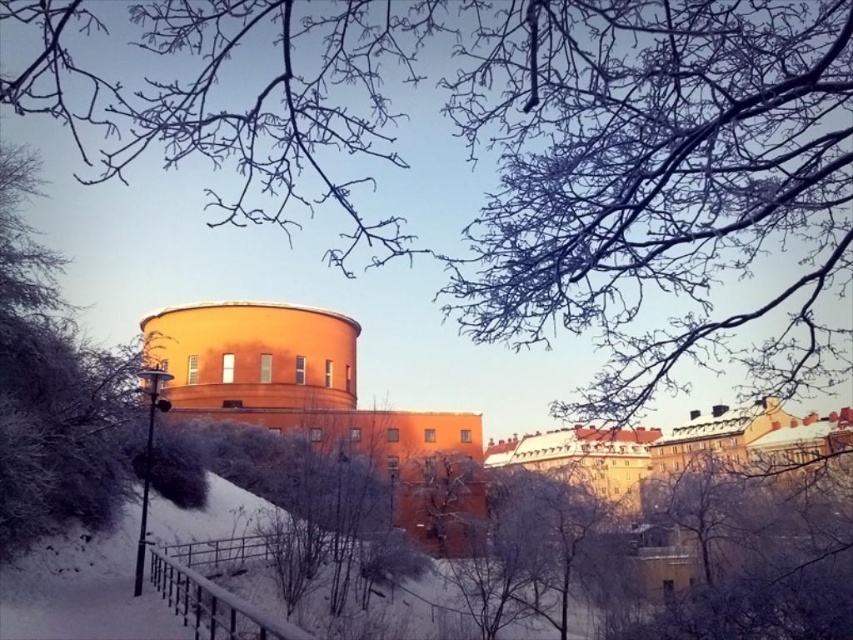
You are standing in front of the orange cylindrical building and want to take a photo of the frosty branches at upper center. Based on their position, where should you aim your camera relative to the building?

The frosty branches at upper center are located at coordinates point (514, 157), so you should aim your camera slightly to the left and above the building to capture them.

You are standing in the winter scene and want to take a photo of the orange cylindrical building. There is a point at coordinates point [355,29] that is 9.88 feet away from you. Is this point close enough to be in focus if your camera has a depth of field that can focus on objects between 8 and 12 feet away?

The point at point [355,29] is 9.88 feet away, which falls within the camera depth of field range of 8 to 12 feet. Therefore, the point will be in focus.